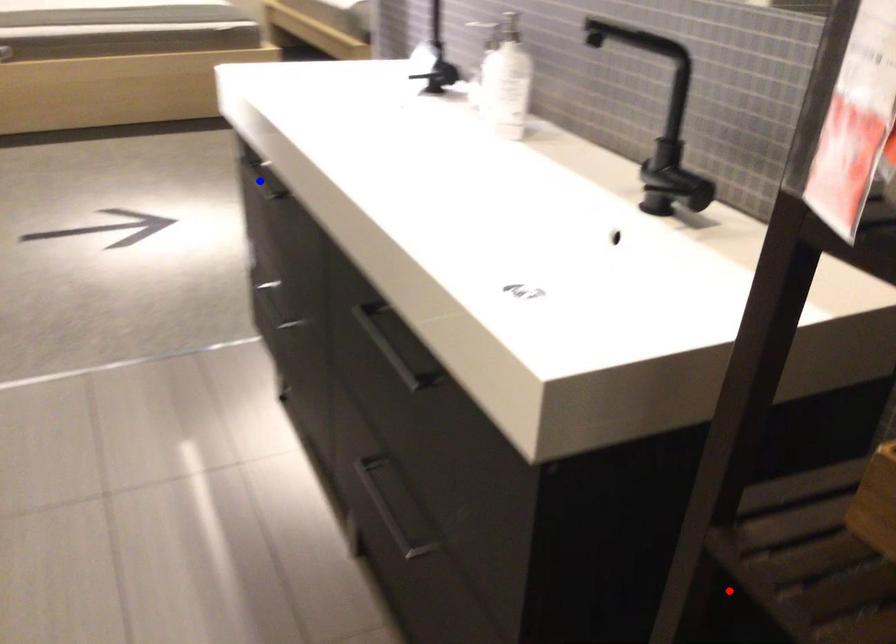
Question: Two points are marked on the image. Which point is closer to the camera?

Choices:
 (A) Blue point is closer.
 (B) Red point is closer.

Answer: (B)